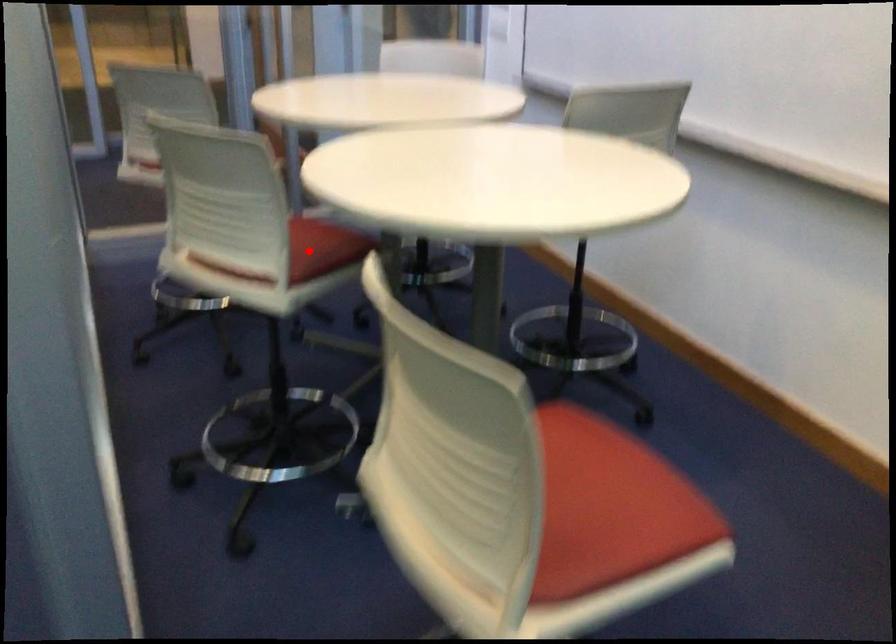
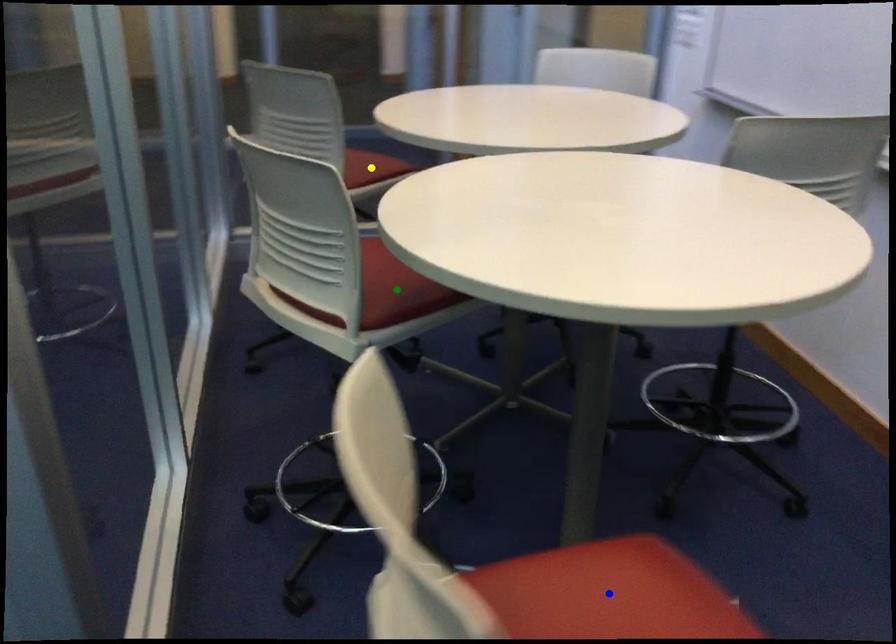
Question: I am providing you with two images of the same scene from different viewpoints. A red point is marked on the first image. You are given multiple points on the second image. In image 2, which mark is for the same physical point as the one in image 1?

Choices:
 (A) yellow point
 (B) green point
 (C) blue point

Answer: (B)